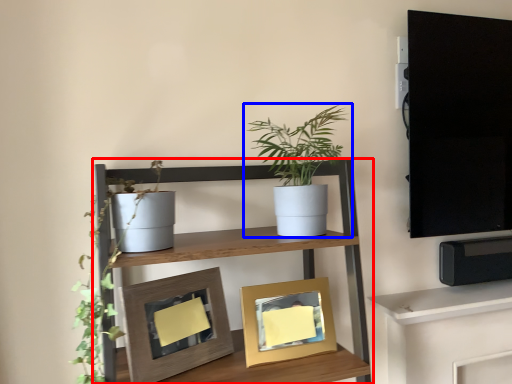
Question: Among these objects, which one is farthest to the camera, shelf (highlighted by a red box) or houseplant (highlighted by a blue box)?

Choices:
 (A) shelf
 (B) houseplant

Answer: (B)